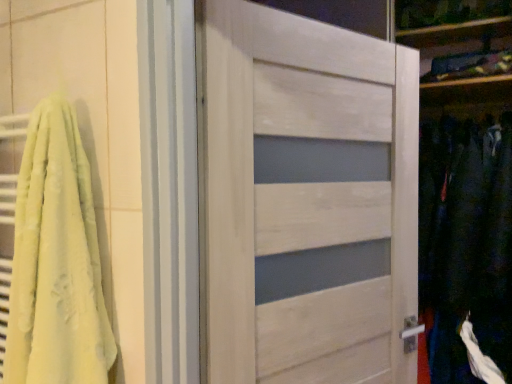
Question: Can you confirm if soft yellow towel at left is shorter than white wood door at center?

Choices:
 (A) yes
 (B) no

Answer: (A)

Question: Can white wood door at center be found inside soft yellow towel at left?

Choices:
 (A) yes
 (B) no

Answer: (B)

Question: Does soft yellow towel at left lie in front of white wood door at center?

Choices:
 (A) yes
 (B) no

Answer: (A)

Question: Is soft yellow towel at left outside white wood door at center?

Choices:
 (A) yes
 (B) no

Answer: (A)

Question: Is soft yellow towel at left next to white wood door at center?

Choices:
 (A) yes
 (B) no

Answer: (B)

Question: Is soft yellow towel at left taller than white wood door at center?

Choices:
 (A) yes
 (B) no

Answer: (B)

Question: Is dark blue fabric at right positioned with its back to soft yellow towel at left?

Choices:
 (A) no
 (B) yes

Answer: (A)

Question: Considering the relative sizes of dark blue fabric at right and soft yellow towel at left in the image provided, is dark blue fabric at right smaller than soft yellow towel at left?

Choices:
 (A) no
 (B) yes

Answer: (A)

Question: From the image's perspective, would you say dark blue fabric at right is positioned over soft yellow towel at left?

Choices:
 (A) no
 (B) yes

Answer: (A)

Question: From the image's perspective, is dark blue fabric at right located beneath soft yellow towel at left?

Choices:
 (A) no
 (B) yes

Answer: (B)

Question: From a real-world perspective, is dark blue fabric at right on soft yellow towel at left?

Choices:
 (A) no
 (B) yes

Answer: (A)

Question: Can you confirm if dark blue fabric at right is positioned to the right of soft yellow towel at left?

Choices:
 (A) yes
 (B) no

Answer: (A)

Question: Is dark blue fabric at right not close to white wood door at center?

Choices:
 (A) no
 (B) yes

Answer: (A)